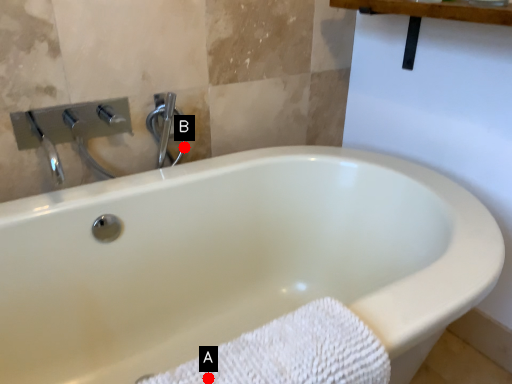
Question: Two points are circled on the image, labeled by A and B beside each circle. Which point is closer to the camera?

Choices:
 (A) A is closer
 (B) B is closer

Answer: (A)